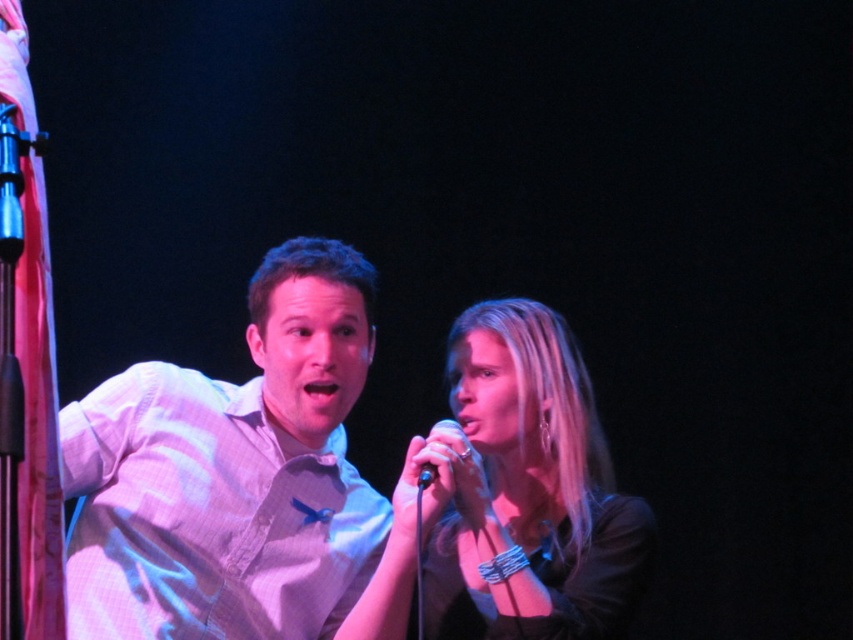
You are a photographer trying to capture a group photo of the performers. The white checkered shirt at center and the smooth black shirt at center are both in the frame. If you want to ensure that both shirts are visible in the photo, which one should you focus on to avoid blurriness due to height differences?

The white checkered shirt at center is much taller than the smooth black shirt at center. To ensure both are in focus, focus on the white checkered shirt at center since it is taller and requires adjusting the depth of field to accommodate its height.

You are a photographer setting up for a concert. You need to position a spotlight so it shines on both the smooth black shirt at center and the black metallic microphone at center. Since the spotlight can only illuminate objects at the same height, will you need to adjust the angle of the spotlight to ensure both are lit?

The smooth black shirt at center is below the black metallic microphone at center, so you will need to adjust the angle of the spotlight to ensure both are lit at the same height.